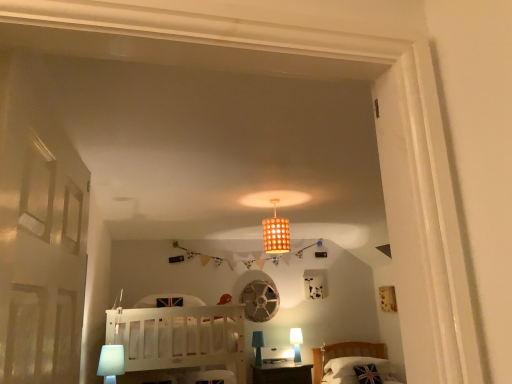
You are a GUI agent. You are given a task and a screenshot of the screen. Output one action in this format:
    pyautogui.click(x=<x>, y=<y>)
    Task: Click on the union jack fabric pillow at lower right
    The image size is (512, 384).
    Given the screenshot: What is the action you would take?
    coord(355,365)

What is the approximate height of white wooden bunk bed at center?

The height of white wooden bunk bed at center is 3.41 feet.

Measure the distance between point (254, 368) and camera.

Point (254, 368) and camera are 17.64 feet apart.

Locate an element on the screen. The width and height of the screenshot is (512, 384). white glossy table lamp at lower right, which ranks as the 3th table lamp in front-to-back order is located at coordinates (296, 343).

Where is `blue fabric table lamp at lower center, positioned as the 2th table lamp in right-to-left order`? blue fabric table lamp at lower center, positioned as the 2th table lamp in right-to-left order is located at coordinates (258, 346).

Is blue fabric table lamp at lower center, positioned as the 2th table lamp in right-to-left order, further to camera compared to white wooden bunk bed at center?

Yes, blue fabric table lamp at lower center, positioned as the 2th table lamp in right-to-left order, is further from the viewer.

Who is taller, blue fabric table lamp at lower center, positioned as the second table lamp in bottom-to-top order, or white wooden bunk bed at center?

Standing taller between the two is white wooden bunk bed at center.

Which object is wider, blue fabric table lamp at lower center, positioned as the second table lamp in bottom-to-top order, or white wooden bunk bed at center?

white wooden bunk bed at center.

Could you measure the distance between blue fabric table lamp at lower center, positioned as the 2th table lamp in right-to-left order, and white wooden bunk bed at center?

blue fabric table lamp at lower center, positioned as the 2th table lamp in right-to-left order, and white wooden bunk bed at center are 3.20 meters apart from each other.

Considering the relative sizes of white wooden bunk bed at center and wooden lampshade at center in the image provided, is white wooden bunk bed at center taller than wooden lampshade at center?

Correct, white wooden bunk bed at center is much taller as wooden lampshade at center.

Is there a large distance between white wooden bunk bed at center and wooden lampshade at center?

Actually, white wooden bunk bed at center and wooden lampshade at center are a little close together.

Consider the image. Is white wooden bunk bed at center positioned behind wooden lampshade at center?

No.

From a real-world perspective, is white wooden bunk bed at center positioned over wooden lampshade at center based on gravity?

Incorrect, from a real-world perspective, white wooden bunk bed at center is lower than wooden lampshade at center.

Looking at their sizes, would you say matte brown wooden table at center is wider or thinner than white plastic table lamp at lower left, arranged as the third table lamp when viewed from the back?

Considering their sizes, matte brown wooden table at center looks broader than white plastic table lamp at lower left, arranged as the third table lamp when viewed from the back.

Is the position of matte brown wooden table at center less distant than that of white plastic table lamp at lower left, which appears as the 1th table lamp when viewed from the top?

No, it is behind white plastic table lamp at lower left, which appears as the 1th table lamp when viewed from the top.

Is matte brown wooden table at center not within white plastic table lamp at lower left, arranged as the third table lamp when ordered from the bottom?

matte brown wooden table at center lies outside white plastic table lamp at lower left, arranged as the third table lamp when ordered from the bottom,'s area.

Is matte brown wooden table at center next to white plastic table lamp at lower left, arranged as the third table lamp when viewed from the back?

matte brown wooden table at center is not next to white plastic table lamp at lower left, arranged as the third table lamp when viewed from the back, and they're not touching.

In the scene shown: Does wooden lampshade at center come behind union jack fabric pillow at lower right?

No.

Considering the relative sizes of wooden lampshade at center and union jack fabric pillow at lower right in the image provided, is wooden lampshade at center wider than union jack fabric pillow at lower right?

In fact, wooden lampshade at center might be narrower than union jack fabric pillow at lower right.

How distant is wooden lampshade at center from union jack fabric pillow at lower right?

10.16 feet.

Consider the image. Can you confirm if wooden lampshade at center is smaller than union jack fabric pillow at lower right?

Yes, wooden lampshade at center is smaller than union jack fabric pillow at lower right.

From the image's perspective, is white wooden bunk bed at center located beneath blue fabric table lamp at lower center, placed as the 2th table lamp when sorted from top to bottom?

Incorrect, from the image's perspective, white wooden bunk bed at center is higher than blue fabric table lamp at lower center, placed as the 2th table lamp when sorted from top to bottom.

Are white wooden bunk bed at center and blue fabric table lamp at lower center, placed as the 2th table lamp when sorted from top to bottom, located far from each other?

white wooden bunk bed at center is far away from blue fabric table lamp at lower center, placed as the 2th table lamp when sorted from top to bottom.

Is white wooden bunk bed at center taller than blue fabric table lamp at lower center, which is counted as the second table lamp, starting from the front?

Yes.

Considering the sizes of objects white wooden bunk bed at center and blue fabric table lamp at lower center, placed as the 2th table lamp when sorted from top to bottom, in the image provided, who is wider, white wooden bunk bed at center or blue fabric table lamp at lower center, placed as the 2th table lamp when sorted from top to bottom,?

With larger width is white wooden bunk bed at center.

Based on their positions, is white plastic table lamp at lower left, placed as the first table lamp when sorted from front to back, located to the left or right of white glossy table lamp at lower right, arranged as the 3th table lamp when viewed from the left?

In the image, white plastic table lamp at lower left, placed as the first table lamp when sorted from front to back, appears on the left side of white glossy table lamp at lower right, arranged as the 3th table lamp when viewed from the left.

Considering the relative sizes of white plastic table lamp at lower left, the 3th table lamp from the right, and white glossy table lamp at lower right, placed as the 1th table lamp when sorted from right to left, in the image provided, is white plastic table lamp at lower left, the 3th table lamp from the right, bigger than white glossy table lamp at lower right, placed as the 1th table lamp when sorted from right to left,?

No.

How many degrees apart are the facing directions of white plastic table lamp at lower left, arranged as the third table lamp when viewed from the back, and white glossy table lamp at lower right, arranged as the 3th table lamp when viewed from the left?

88 degrees separate the facing orientations of white plastic table lamp at lower left, arranged as the third table lamp when viewed from the back, and white glossy table lamp at lower right, arranged as the 3th table lamp when viewed from the left.

Is white plastic table lamp at lower left, placed as the first table lamp when sorted from front to back, oriented away from white glossy table lamp at lower right, which ranks as the 3th table lamp in front-to-back order?

No, white plastic table lamp at lower left, placed as the first table lamp when sorted from front to back, is not facing away from white glossy table lamp at lower right, which ranks as the 3th table lamp in front-to-back order.

Considering the relative sizes of white glossy table lamp at lower right, arranged as the 3th table lamp when viewed from the left, and union jack fabric pillow at lower right in the image provided, is white glossy table lamp at lower right, arranged as the 3th table lamp when viewed from the left, taller than union jack fabric pillow at lower right?

Correct, white glossy table lamp at lower right, arranged as the 3th table lamp when viewed from the left, is much taller as union jack fabric pillow at lower right.

Is white glossy table lamp at lower right, placed as the 1th table lamp when sorted from right to left, positioned in front of union jack fabric pillow at lower right?

No, white glossy table lamp at lower right, placed as the 1th table lamp when sorted from right to left, is further to the viewer.

Is white glossy table lamp at lower right, arranged as the first table lamp when ordered from the bottom, not close to union jack fabric pillow at lower right?

No, there isn't a large distance between white glossy table lamp at lower right, arranged as the first table lamp when ordered from the bottom, and union jack fabric pillow at lower right.

Looking at the image, does white glossy table lamp at lower right, which ranks as the 3th table lamp in front-to-back order, seem bigger or smaller compared to union jack fabric pillow at lower right?

Considering their sizes, white glossy table lamp at lower right, which ranks as the 3th table lamp in front-to-back order, takes up less space than union jack fabric pillow at lower right.

You are a GUI agent. You are given a task and a screenshot of the screen. Output one action in this format:
    pyautogui.click(x=<x>, y=<y>)
    Task: Click on the 1st table lamp positioned below the white wooden bunk bed at center (from the image's perspective)
    Image resolution: width=512 pixels, height=384 pixels.
    Given the screenshot: What is the action you would take?
    pos(258,346)

Locate an element on the screen. lamp located on the right of white wooden bunk bed at center is located at coordinates (276, 233).

From the image, which object appears to be nearer to blue fabric table lamp at lower center, placed as the 2th table lamp when sorted from top to bottom, matte brown wooden table at center or white wooden bunk bed at center?

The object closer to blue fabric table lamp at lower center, placed as the 2th table lamp when sorted from top to bottom, is matte brown wooden table at center.

When comparing their distances from matte brown wooden table at center, does white glossy table lamp at lower right, the first table lamp positioned from the back, or wooden lampshade at center seem further?

wooden lampshade at center lies further to matte brown wooden table at center than the other object.

When comparing their distances from union jack fabric pillow at lower right, does white wooden bunk bed at center or matte brown wooden table at center seem closer?

matte brown wooden table at center.

When comparing their distances from white plastic table lamp at lower left, the 3th table lamp from the right, does white wooden bunk bed at center or blue fabric table lamp at lower center, placed as the 2th table lamp when sorted from top to bottom, seem closer?

Among the two, white wooden bunk bed at center is located nearer to white plastic table lamp at lower left, the 3th table lamp from the right.

Estimate the real-world distances between objects in this image. Which object is closer to matte brown wooden table at center, wooden lampshade at center or white wooden bunk bed at center?

Based on the image, white wooden bunk bed at center appears to be nearer to matte brown wooden table at center.

Consider the image. When comparing their distances from wooden lampshade at center, does blue fabric table lamp at lower center, positioned as the second table lamp in bottom-to-top order, or white glossy table lamp at lower right, placed as the 1th table lamp when sorted from right to left, seem closer?

The object closer to wooden lampshade at center is blue fabric table lamp at lower center, positioned as the second table lamp in bottom-to-top order.

Which object lies further to the anchor point white glossy table lamp at lower right, which ranks as the 3th table lamp in front-to-back order, wooden lampshade at center or union jack fabric pillow at lower right?

wooden lampshade at center is further to white glossy table lamp at lower right, which ranks as the 3th table lamp in front-to-back order.

Looking at the image, which one is located closer to matte brown wooden table at center, white plastic table lamp at lower left, arranged as the third table lamp when ordered from the bottom, or union jack fabric pillow at lower right?

union jack fabric pillow at lower right.

The image size is (512, 384). Identify the location of table between white wooden bunk bed at center and white glossy table lamp at lower right, arranged as the first table lamp when ordered from the bottom, along the z-axis. (282, 373).

The height and width of the screenshot is (384, 512). Find the location of `furniture between white plastic table lamp at lower left, arranged as the third table lamp when ordered from the bottom, and white glossy table lamp at lower right, marked as the 3th table lamp in a top-to-bottom arrangement, in the front-back direction`. furniture between white plastic table lamp at lower left, arranged as the third table lamp when ordered from the bottom, and white glossy table lamp at lower right, marked as the 3th table lamp in a top-to-bottom arrangement, in the front-back direction is located at coordinates (180, 337).

Identify the location of lamp located between white wooden bunk bed at center and matte brown wooden table at center in the depth direction. This screenshot has height=384, width=512. tap(276, 233).

Locate an element on the screen. This screenshot has width=512, height=384. table lamp situated between matte brown wooden table at center and union jack fabric pillow at lower right from left to right is located at coordinates (296, 343).